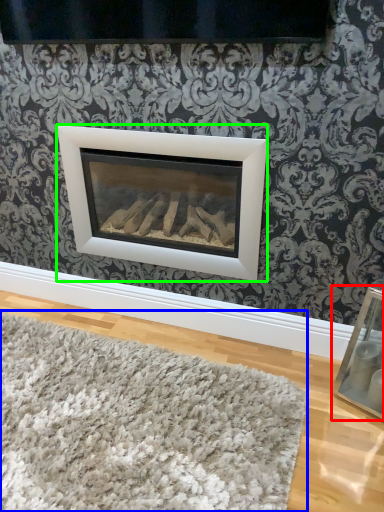
Question: Which object is positioned closest to picture frame (highlighted by a red box)? Select from mat (highlighted by a blue box) and fireplace (highlighted by a green box).

Choices:
 (A) mat
 (B) fireplace

Answer: (A)